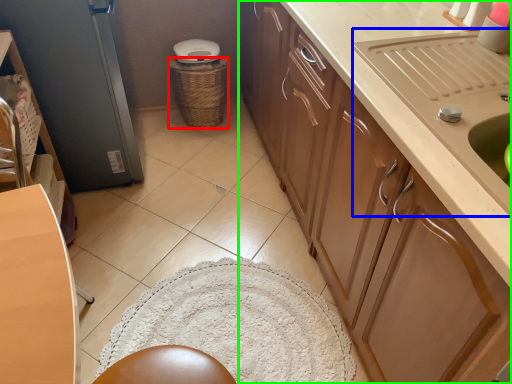
Question: Considering the real-world distances, which object is farthest from basket (highlighted by a red box)? sink (highlighted by a blue box) or cabinetry (highlighted by a green box)?

Choices:
 (A) sink
 (B) cabinetry

Answer: (A)